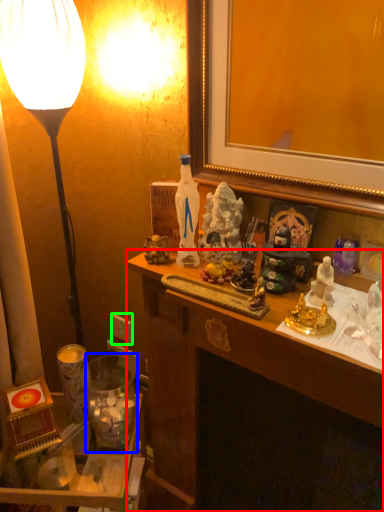
Question: Which object is the closest to the desk (highlighted by a red box)? Choose among these: candle holder (highlighted by a blue box) or power outlet (highlighted by a green box).

Choices:
 (A) candle holder
 (B) power outlet

Answer: (A)